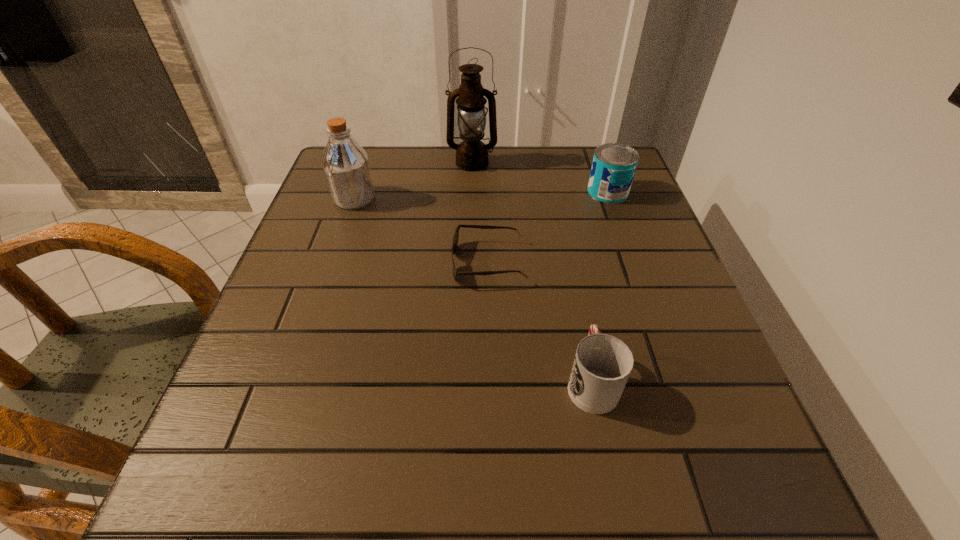
Where is `free location that satisfies the following two spatial constraints: 1. on the side of the rightmost object where the handle is located; 2. on the left side of the cup`? free location that satisfies the following two spatial constraints: 1. on the side of the rightmost object where the handle is located; 2. on the left side of the cup is located at coordinates (553, 192).

Identify the location of vacant space that satisfies the following two spatial constraints: 1. on the back side of the farthest object; 2. on the right side of the leftmost object. (367, 163).

The image size is (960, 540). I want to click on vacant region that satisfies the following two spatial constraints: 1. on the side of the fourth object from left to right where the handle is located; 2. on the lenses of the shortest object, so click(567, 262).